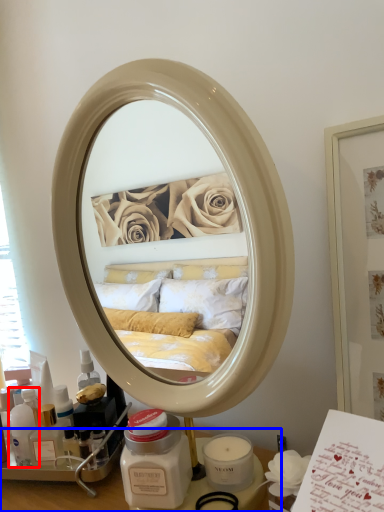
Question: Which object appears farthest to the camera in this image, toiletry (highlighted by a red box) or vanity (highlighted by a blue box)?

Choices:
 (A) toiletry
 (B) vanity

Answer: (A)